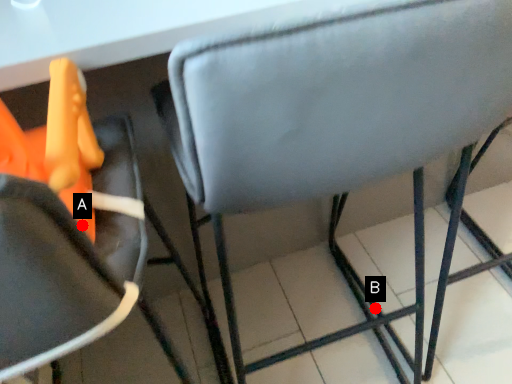
Question: Two points are circled on the image, labeled by A and B beside each circle. Which point appears closest to the camera in this image?

Choices:
 (A) A is closer
 (B) B is closer

Answer: (A)